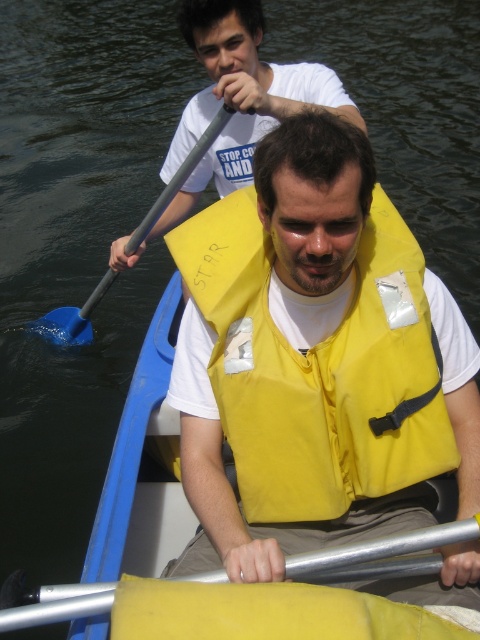
Is point (212, 44) positioned in front of point (436, 531)?

No, (212, 44) is further to viewer.

Where is `yellow life vest at center`? The width and height of the screenshot is (480, 640). yellow life vest at center is located at coordinates (239, 99).

Is point (0, 614) farther from camera compared to point (69, 342)?

No, (0, 614) is closer to viewer.

Does yellow rubber paddle at center come behind blue rubber paddle at left?

No, it is not.

Is point (31, 616) closer to camera compared to point (143, 228)?

Yes, point (31, 616) is closer to viewer.

At what (x,y) coordinates should I click in order to perform the action: click on yellow rubber paddle at center. Please return your answer as a coordinate pair (x, y). The image size is (480, 640). Looking at the image, I should click on (385, 547).

This screenshot has height=640, width=480. Describe the element at coordinates (239, 99) in the screenshot. I see `yellow life vest at center` at that location.

Is yellow life vest at center smaller than blue rubber paddle at left?

No, yellow life vest at center is not smaller than blue rubber paddle at left.

Is point (176, 138) positioned after point (41, 333)?

No, it is not.

Locate an element on the screen. This screenshot has width=480, height=640. yellow life vest at center is located at coordinates (239, 99).